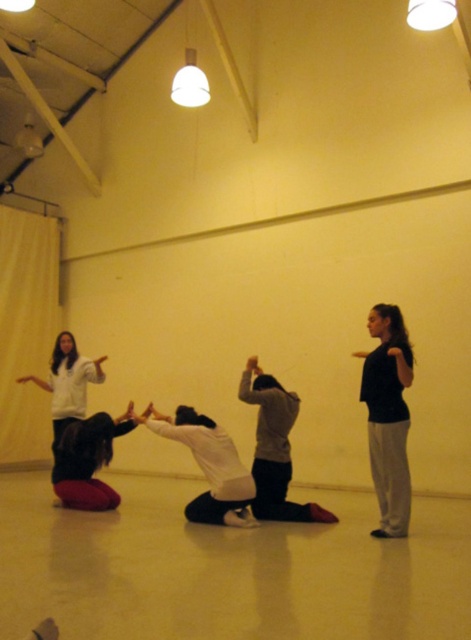
Question: Does white matte squat at center have a larger size compared to dark gray fabric squat at center?

Choices:
 (A) yes
 (B) no

Answer: (A)

Question: Is black matte shirt at right wider than dark gray fabric squat at center?

Choices:
 (A) no
 (B) yes

Answer: (A)

Question: Which object is positioned closest to the dark gray fabric squat at center?

Choices:
 (A) white matte squat at center
 (B) black matte shirt at right

Answer: (A)

Question: Estimate the real-world distances between objects in this image. Which object is farther from the white matte squat at center?

Choices:
 (A) black matte shirt at right
 (B) dark gray fabric squat at center

Answer: (A)

Question: Does black matte shirt at right appear over dark gray fabric squat at center?

Choices:
 (A) no
 (B) yes

Answer: (B)

Question: Which object appears farthest from the camera in this image?

Choices:
 (A) white matte squat at center
 (B) black matte shirt at right

Answer: (A)